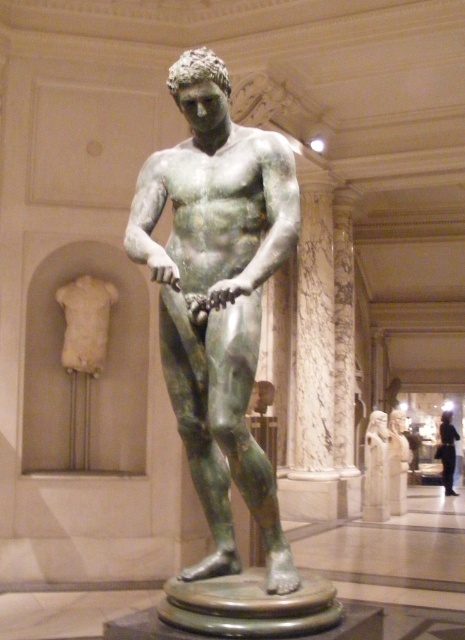
Question: Where is green patinated bronze statue at center located in relation to bronze statue at center in the image?

Choices:
 (A) right
 (B) left

Answer: (B)

Question: Is green patinated bronze statue at center further to camera compared to bronze statue at center?

Choices:
 (A) yes
 (B) no

Answer: (B)

Question: Among these objects, which one is farthest from the camera?

Choices:
 (A) bronze statue at center
 (B) green patinated bronze statue at center

Answer: (A)

Question: Which of the following is the closest to the observer?

Choices:
 (A) bronze statue at center
 (B) green patinated bronze statue at center

Answer: (B)

Question: Is green patinated bronze statue at center bigger than bronze statue at center?

Choices:
 (A) yes
 (B) no

Answer: (B)